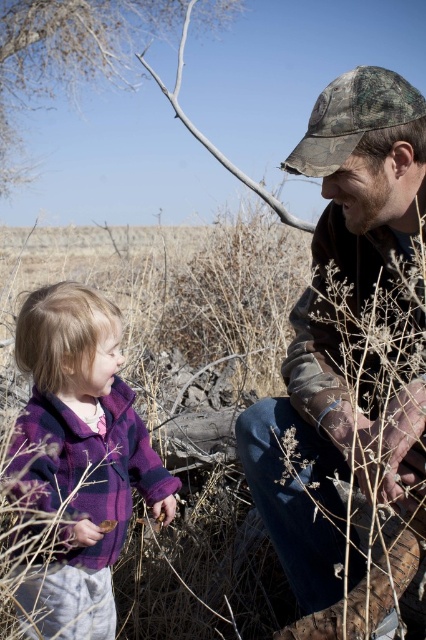
Does camouflage fabric hat at upper right lie behind purple fleece jacket at left?

No, it is not.

The image size is (426, 640). In order to click on camouflage fabric hat at upper right in this screenshot , I will do `click(331, 316)`.

Where is `camouflage fabric hat at upper right`? Image resolution: width=426 pixels, height=640 pixels. camouflage fabric hat at upper right is located at coordinates (331, 316).